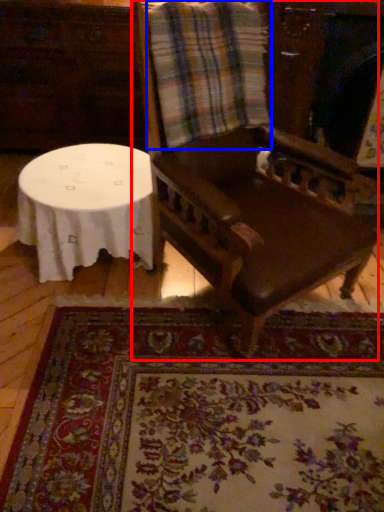
Question: Which of the following is the farthest to the observer, chair (highlighted by a red box) or flannel (highlighted by a blue box)?

Choices:
 (A) chair
 (B) flannel

Answer: (B)